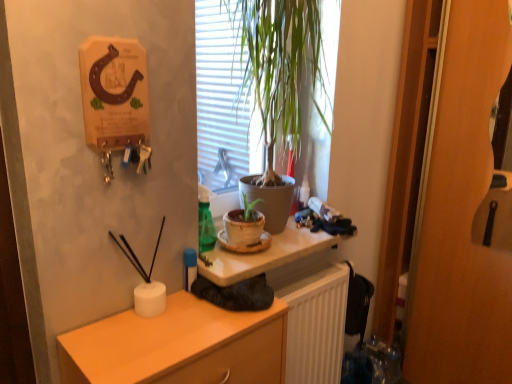
Question: Choose the correct answer: Is matte orange cabinet at lower left inside matte white desk at center or outside it?

Choices:
 (A) inside
 (B) outside

Answer: (B)

Question: Is matte orange cabinet at lower left taller or shorter than matte white desk at center?

Choices:
 (A) short
 (B) tall

Answer: (B)

Question: Which object is the farthest from the green leafy plant at center?

Choices:
 (A) matte white desk at center
 (B) matte orange cabinet at lower left
 (C) white ribbed radiator at lower center

Answer: (B)

Question: Considering the real-world distances, which object is farthest from the matte white desk at center?

Choices:
 (A) matte orange cabinet at lower left
 (B) white ribbed radiator at lower center
 (C) green leafy plant at center

Answer: (C)